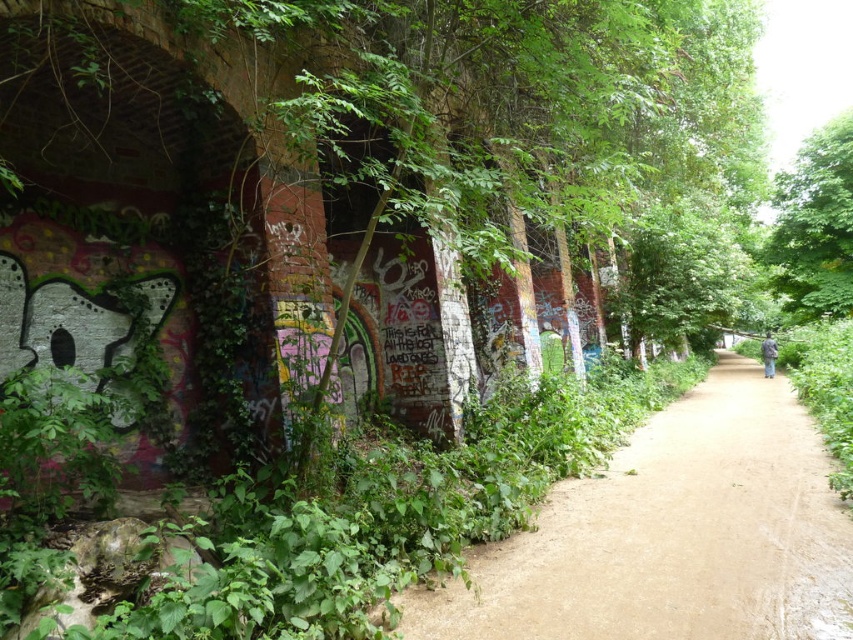
You are standing at the starting point of the scene and want to follow the brown dirt path at center to reach the person walking away. According to the coordinates provided, in which direction should you walk to stay on the path?

The brown dirt path at center is located at coordinates point (x=672, y=534). Since the path is at the center of the scene, you should walk straight ahead to stay on the path towards the person.

Looking at this image, you are standing on the brown dirt path at center and want to walk towards the green leafy tree at upper right. Which direction should you head?

To reach the green leafy tree at upper right from the brown dirt path at center, you should head to the right since the brown dirt path at center is located to the left of the green leafy tree at upper right.